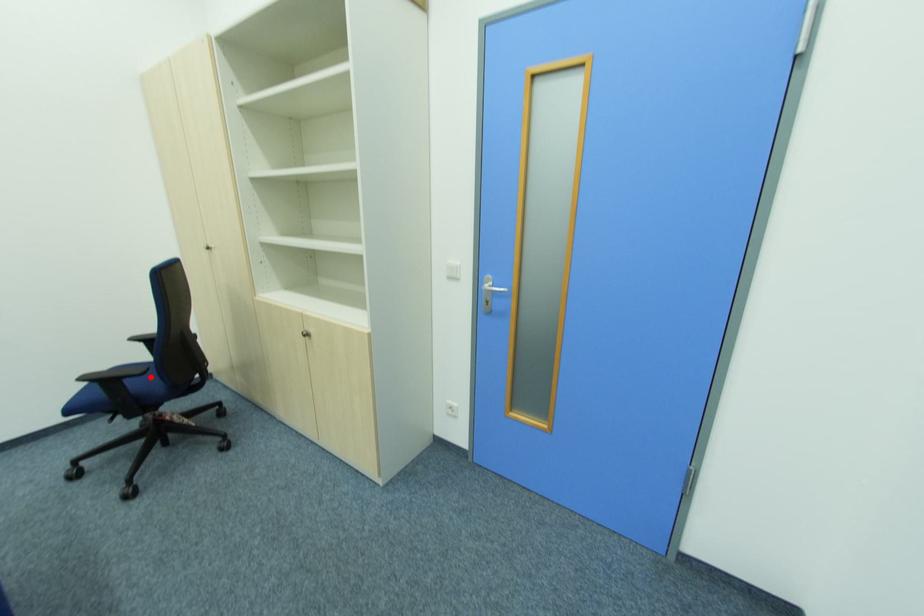
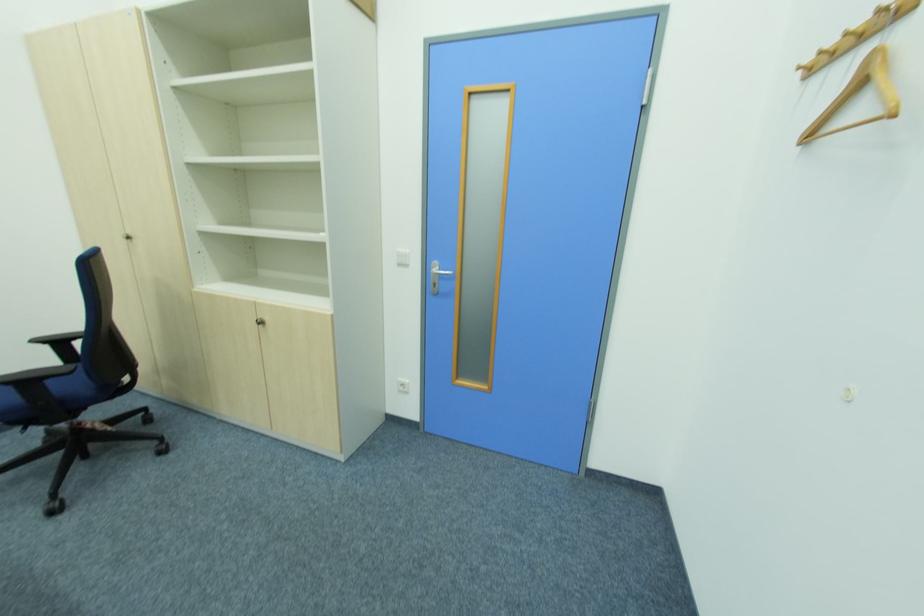
The point at the highlighted location is marked in the first image. Where is the corresponding point in the second image?

(75, 379)